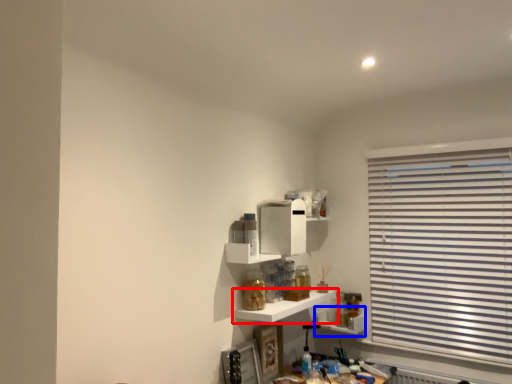
Question: Which object is closer to the camera taking this photo, shelf (highlighted by a red box) or shelf (highlighted by a blue box)?

Choices:
 (A) shelf
 (B) shelf

Answer: (A)